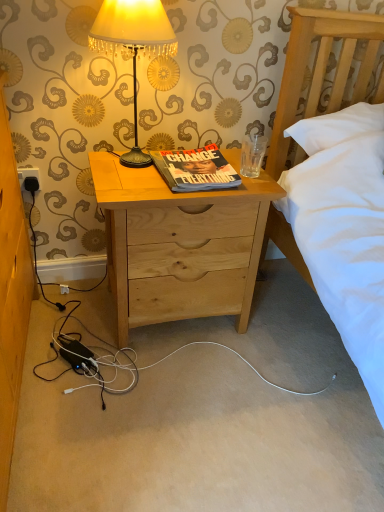
Locate an element on the screen. The image size is (384, 512). free region under metallic lampshade at upper center (from a real-world perspective) is located at coordinates (132, 164).